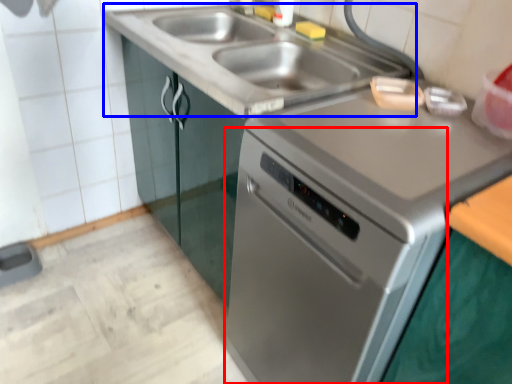
Question: Which of the following is the farthest to the observer, oven (highlighted by a red box) or sink (highlighted by a blue box)?

Choices:
 (A) oven
 (B) sink

Answer: (B)